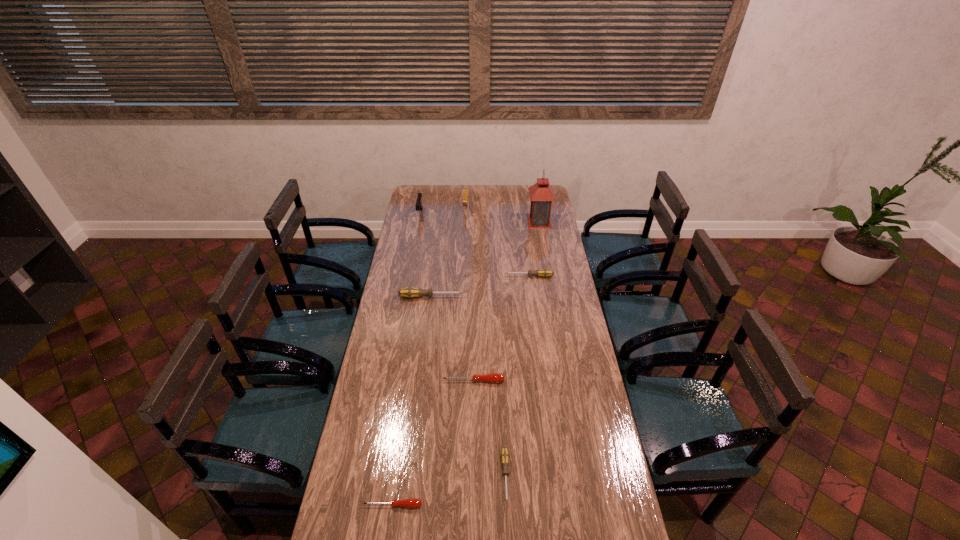
Where is `free space in the image that satisfies the following two spatial constraints: 1. on the front side of the lantern; 2. at the tip of the rightmost gray screwdriver`? This screenshot has height=540, width=960. free space in the image that satisfies the following two spatial constraints: 1. on the front side of the lantern; 2. at the tip of the rightmost gray screwdriver is located at coordinates (549, 276).

Find the location of a particular element. free point that satisfies the following two spatial constraints: 1. at the barrel of the tan pistol; 2. on the right side of the bigger red screwdriver is located at coordinates (457, 381).